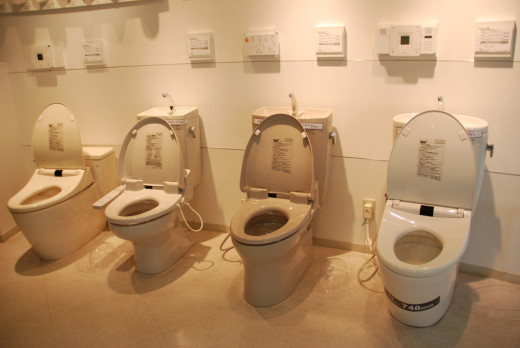
At what (x,y) coordinates should I click in order to perform the action: click on brown baseboard. Please return your answer as a coordinate pair (x, y). This screenshot has height=348, width=520. Looking at the image, I should click on (341, 247).